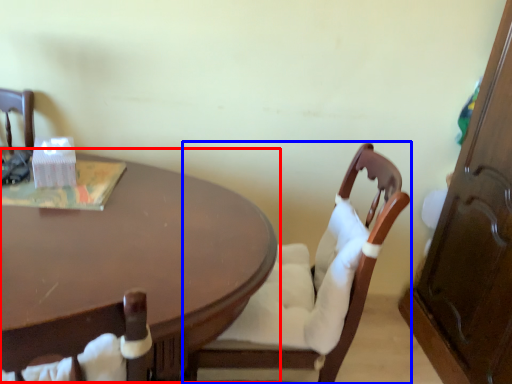
Question: Which point is closer to the camera, coffee table (highlighted by a red box) or chair (highlighted by a blue box)?

Choices:
 (A) coffee table
 (B) chair

Answer: (A)